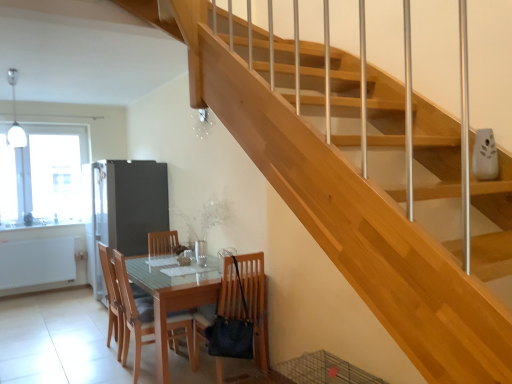
What do you see at coordinates (42, 231) in the screenshot? The image size is (512, 384). I see `white glossy countertop at lower left` at bounding box center [42, 231].

Where is `satin silver refrigerator at left`? Image resolution: width=512 pixels, height=384 pixels. satin silver refrigerator at left is located at coordinates (129, 203).

Describe the element at coordinates (42, 173) in the screenshot. I see `transparent glass window at upper left` at that location.

Identify the location of matte brown chair at lower center, acting as the 3th chair starting from the left. The height and width of the screenshot is (384, 512). (246, 300).

Between light brown wood chair at center, which ranks as the 2th chair in left-to-right order, and white glossy countertop at lower left, which one has smaller width?

Thinner between the two is white glossy countertop at lower left.

Would you consider light brown wood chair at center, which ranks as the 2th chair in left-to-right order, to be distant from white glossy countertop at lower left?

Absolutely, light brown wood chair at center, which ranks as the 2th chair in left-to-right order, is distant from white glossy countertop at lower left.

Who is shorter, light brown wood chair at center, which ranks as the 2th chair in left-to-right order, or white glossy countertop at lower left?

white glossy countertop at lower left is shorter.

Does light brown wood chair at center, marked as the 2th chair in a right-to-left arrangement, come behind white glossy countertop at lower left?

No, the depth of light brown wood chair at center, marked as the 2th chair in a right-to-left arrangement, is less than that of white glossy countertop at lower left.

Between light wood/wooden chair at lower left, the third chair in the right-to-left sequence, and satin silver refrigerator at left, which one has smaller size?

light wood/wooden chair at lower left, the third chair in the right-to-left sequence, is smaller.

Do you think light wood/wooden chair at lower left, which is the first chair from left to right, is within satin silver refrigerator at left, or outside of it?

light wood/wooden chair at lower left, which is the first chair from left to right, is not inside satin silver refrigerator at left, it's outside.

Who is shorter, light wood/wooden chair at lower left, the third chair in the right-to-left sequence, or satin silver refrigerator at left?

light wood/wooden chair at lower left, the third chair in the right-to-left sequence, is shorter.

From a real-world perspective, which is physically above, light wood/wooden chair at lower left, which is the first chair from left to right, or satin silver refrigerator at left?

From a 3D spatial view, satin silver refrigerator at left is above.

Is light brown wood chair at center, marked as the 2th chair in a right-to-left arrangement, at the left side of matte brown chair at lower center, acting as the 3th chair starting from the left?

Indeed, light brown wood chair at center, marked as the 2th chair in a right-to-left arrangement, is positioned on the left side of matte brown chair at lower center, acting as the 3th chair starting from the left.

From the image's perspective, which is below, light brown wood chair at center, marked as the 2th chair in a right-to-left arrangement, or matte brown chair at lower center, placed as the 1th chair when sorted from right to left?

light brown wood chair at center, marked as the 2th chair in a right-to-left arrangement.

Is light brown wood chair at center, which ranks as the 2th chair in left-to-right order, in contact with matte brown chair at lower center, acting as the 3th chair starting from the left?

There is a gap between light brown wood chair at center, which ranks as the 2th chair in left-to-right order, and matte brown chair at lower center, acting as the 3th chair starting from the left.

From the picture: Considering the sizes of objects light brown wood chair at center, marked as the 2th chair in a right-to-left arrangement, and matte brown chair at lower center, placed as the 1th chair when sorted from right to left, in the image provided, who is taller, light brown wood chair at center, marked as the 2th chair in a right-to-left arrangement, or matte brown chair at lower center, placed as the 1th chair when sorted from right to left,?

With more height is matte brown chair at lower center, placed as the 1th chair when sorted from right to left.

Is the depth of matte brown chair at lower center, placed as the 1th chair when sorted from right to left, less than that of light wood/wooden chair at lower left, the third chair in the right-to-left sequence?

Yes, matte brown chair at lower center, placed as the 1th chair when sorted from right to left, is closer to the viewer.

Identify the location of chair located above the light wood/wooden chair at lower left, which is the first chair from left to right (from the image's perspective). [x=246, y=300].

How different are the orientations of matte brown chair at lower center, placed as the 1th chair when sorted from right to left, and light wood/wooden chair at lower left, which is the first chair from left to right, in degrees?

The facing directions of matte brown chair at lower center, placed as the 1th chair when sorted from right to left, and light wood/wooden chair at lower left, which is the first chair from left to right, are 87.5 degrees apart.

From a real-world perspective, between matte wooden table at center and satin silver refrigerator at left, who is vertically lower?

From a 3D spatial view, matte wooden table at center is below.

Considering the sizes of matte wooden table at center and satin silver refrigerator at left in the image, is matte wooden table at center bigger or smaller than satin silver refrigerator at left?

Clearly, matte wooden table at center is smaller in size than satin silver refrigerator at left.

Is the depth of matte wooden table at center greater than that of satin silver refrigerator at left?

No, it is in front of satin silver refrigerator at left.

From the image's perspective, which is below, matte wooden table at center or satin silver refrigerator at left?

From the image's view, matte wooden table at center is below.

Is light wood/wooden chair at lower left, the third chair in the right-to-left sequence, not within matte brown chair at lower center, placed as the 1th chair when sorted from right to left?

Yes, light wood/wooden chair at lower left, the third chair in the right-to-left sequence, is not within matte brown chair at lower center, placed as the 1th chair when sorted from right to left.

Between point (114, 328) and point (230, 318), which one is positioned in front?

Point (230, 318)

Is light wood/wooden chair at lower left, which is the first chair from left to right, closer to the viewer compared to matte brown chair at lower center, placed as the 1th chair when sorted from right to left?

No, it is not.

What's the angular difference between light wood/wooden chair at lower left, the third chair in the right-to-left sequence, and matte brown chair at lower center, placed as the 1th chair when sorted from right to left,'s facing directions?

light wood/wooden chair at lower left, the third chair in the right-to-left sequence, and matte brown chair at lower center, placed as the 1th chair when sorted from right to left, are facing 87.5 degrees away from each other.

Does light brown wood chair at center, marked as the 2th chair in a right-to-left arrangement, have a smaller size compared to satin silver refrigerator at left?

Yes.

Based on the photo, from a real-world perspective, between light brown wood chair at center, marked as the 2th chair in a right-to-left arrangement, and satin silver refrigerator at left, who is vertically lower?

light brown wood chair at center, marked as the 2th chair in a right-to-left arrangement, from a real-world perspective.

Is light brown wood chair at center, which ranks as the 2th chair in left-to-right order, not within satin silver refrigerator at left?

Yes, light brown wood chair at center, which ranks as the 2th chair in left-to-right order, is outside of satin silver refrigerator at left.

Is the surface of light brown wood chair at center, marked as the 2th chair in a right-to-left arrangement, in direct contact with satin silver refrigerator at left?

No, light brown wood chair at center, marked as the 2th chair in a right-to-left arrangement, is not making contact with satin silver refrigerator at left.

The image size is (512, 384). I want to click on counter top above the light brown wood chair at center, which ranks as the 2th chair in left-to-right order (from the image's perspective), so click(x=42, y=231).

Locate an element on the screen. This screenshot has height=384, width=512. the 1st chair counting from the right side of the satin silver refrigerator at left is located at coordinates (111, 295).

From the image, which object appears to be nearer to light wood/wooden chair at lower left, which is the first chair from left to right, transparent glass window at upper left or matte wooden table at center?

Among the two, matte wooden table at center is located nearer to light wood/wooden chair at lower left, which is the first chair from left to right.

Considering their positions, is light wood/wooden chair at lower left, the third chair in the right-to-left sequence, positioned closer to matte wooden table at center than satin silver refrigerator at left?

The object closer to matte wooden table at center is light wood/wooden chair at lower left, the third chair in the right-to-left sequence.

In the scene shown: Based on their spatial positions, is white glossy countertop at lower left or satin silver refrigerator at left closer to light wood/wooden chair at lower left, the third chair in the right-to-left sequence?

satin silver refrigerator at left is closer to light wood/wooden chair at lower left, the third chair in the right-to-left sequence.

Estimate the real-world distances between objects in this image. Which object is closer to satin silver refrigerator at left, light brown wood chair at center, which ranks as the 2th chair in left-to-right order, or light wood/wooden chair at lower left, the third chair in the right-to-left sequence?

light wood/wooden chair at lower left, the third chair in the right-to-left sequence.

Considering their positions, is white glossy countertop at lower left positioned further to matte brown chair at lower center, placed as the 1th chair when sorted from right to left, than satin silver refrigerator at left?

Based on the image, white glossy countertop at lower left appears to be further to matte brown chair at lower center, placed as the 1th chair when sorted from right to left.

Based on their spatial positions, is matte wooden table at center or transparent glass window at upper left further from light wood/wooden chair at lower left, which is the first chair from left to right?

transparent glass window at upper left.

Considering their positions, is matte brown chair at lower center, acting as the 3th chair starting from the left, positioned closer to matte wooden table at center than transparent glass window at upper left?

The object closer to matte wooden table at center is matte brown chair at lower center, acting as the 3th chair starting from the left.

From the image, which object appears to be farther from light brown wood chair at center, which ranks as the 2th chair in left-to-right order, transparent glass window at upper left or matte wooden table at center?

transparent glass window at upper left is further to light brown wood chair at center, which ranks as the 2th chair in left-to-right order.

The image size is (512, 384). Identify the location of counter top located between transparent glass window at upper left and matte brown chair at lower center, acting as the 3th chair starting from the left, in the left-right direction. (42, 231).

Locate an element on the screen. The width and height of the screenshot is (512, 384). appliance located between light brown wood chair at center, marked as the 2th chair in a right-to-left arrangement, and white glossy countertop at lower left in the depth direction is located at coordinates (129, 203).

The height and width of the screenshot is (384, 512). What are the coordinates of `counter top between light brown wood chair at center, marked as the 2th chair in a right-to-left arrangement, and transparent glass window at upper left from front to back` in the screenshot? It's located at (42, 231).

Where is `counter top between transparent glass window at upper left and satin silver refrigerator at left in the horizontal direction`? The height and width of the screenshot is (384, 512). counter top between transparent glass window at upper left and satin silver refrigerator at left in the horizontal direction is located at coordinates (42, 231).